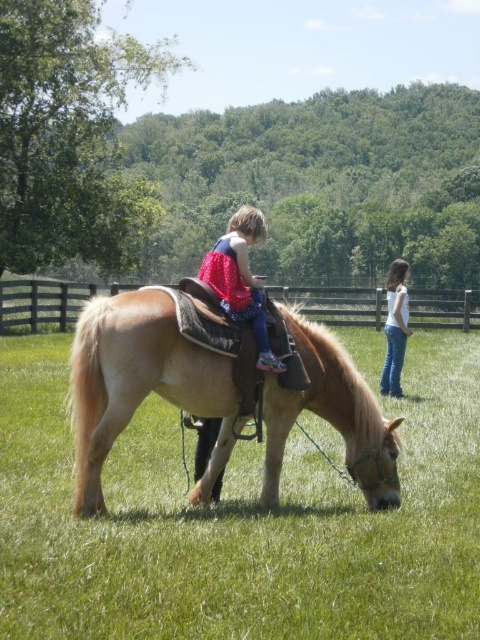
Question: Does light brown leather horse at center appear on the left side of matte pink dress at center?

Choices:
 (A) no
 (B) yes

Answer: (B)

Question: Which is nearer to the light brown leather horse at center?

Choices:
 (A) green grassy field at center
 (B) matte pink dress at center

Answer: (B)

Question: Can you confirm if matte pink dress at center is positioned to the left of white denim jeans at right?

Choices:
 (A) no
 (B) yes

Answer: (B)

Question: Does green grassy field at center appear over matte pink dress at center?

Choices:
 (A) no
 (B) yes

Answer: (A)

Question: Estimate the real-world distances between objects in this image. Which object is farther from the green grassy field at center?

Choices:
 (A) white denim jeans at right
 (B) light brown leather horse at center

Answer: (A)

Question: Among these objects, which one is nearest to the camera?

Choices:
 (A) matte pink dress at center
 (B) white denim jeans at right

Answer: (A)